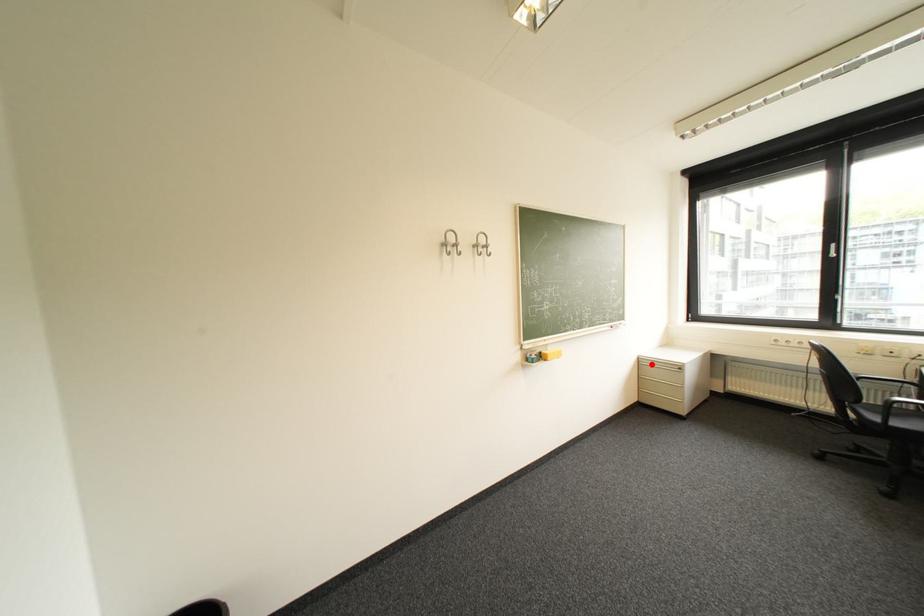
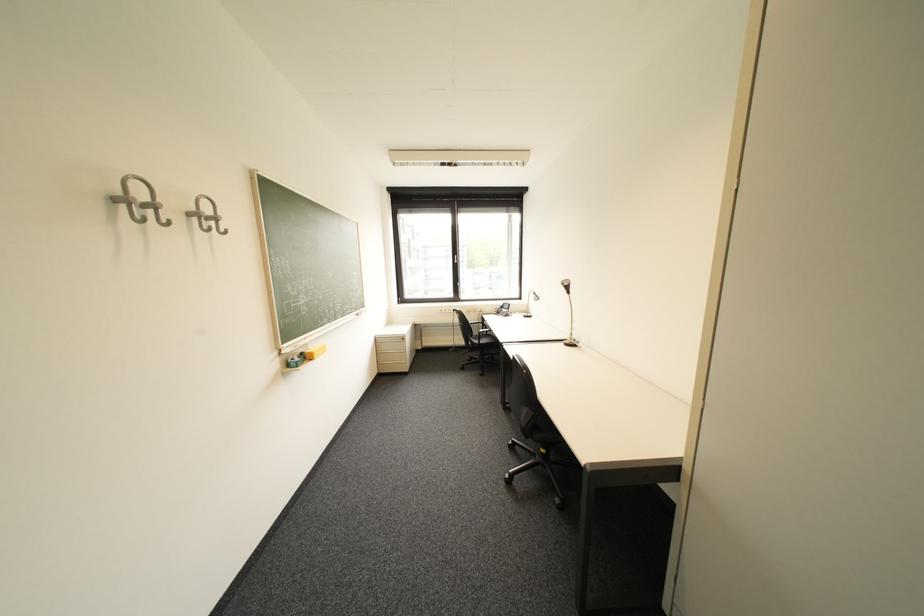
Find the pixel in the second image that matches the highlighted location in the first image.

(388, 342)